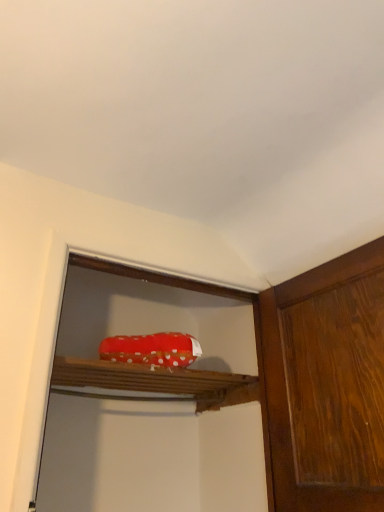
Describe the element at coordinates (152, 383) in the screenshot. The width and height of the screenshot is (384, 512). I see `wooden cabinet at center` at that location.

Find the location of a particular element. wooden cabinet at center is located at coordinates (152, 383).

This screenshot has height=512, width=384. What do you see at coordinates (152, 349) in the screenshot?
I see `red polka dot fabric at center` at bounding box center [152, 349].

Find the location of a particular element. The width and height of the screenshot is (384, 512). red polka dot fabric at center is located at coordinates (152, 349).

Locate an element on the screen. The image size is (384, 512). wooden cabinet at center is located at coordinates (152, 383).

Does red polka dot fabric at center appear on the left side of wooden cabinet at center?

No.

Is red polka dot fabric at center positioned in front of wooden cabinet at center?

No.

Does point (127, 343) come farther from viewer compared to point (109, 369)?

Yes, it is.

From the image's perspective, is red polka dot fabric at center located above or below wooden cabinet at center?

red polka dot fabric at center is situated higher than wooden cabinet at center in the image.

From a real-world perspective, is red polka dot fabric at center above or below wooden cabinet at center?

From a real-world perspective, red polka dot fabric at center is physically above wooden cabinet at center.

Can you confirm if red polka dot fabric at center is wider than wooden cabinet at center?

No, red polka dot fabric at center is not wider than wooden cabinet at center.

Who is shorter, red polka dot fabric at center or wooden cabinet at center?

Standing shorter between the two is red polka dot fabric at center.

Considering the sizes of objects red polka dot fabric at center and wooden cabinet at center in the image provided, who is smaller, red polka dot fabric at center or wooden cabinet at center?

red polka dot fabric at center is smaller.

Is red polka dot fabric at center located outside wooden cabinet at center?

red polka dot fabric at center lies outside wooden cabinet at center's area.

Is red polka dot fabric at center not near wooden cabinet at center?

That's not correct — red polka dot fabric at center is a little close to wooden cabinet at center.

Is red polka dot fabric at center facing away from wooden cabinet at center?

No, wooden cabinet at center is not at the back of red polka dot fabric at center.

At what (x,y) coordinates should I click in order to perform the action: click on stuff located behind the wooden cabinet at center. Please return your answer as a coordinate pair (x, y). The width and height of the screenshot is (384, 512). Looking at the image, I should click on (152, 349).

Considering the positions of objects wooden cabinet at center and red polka dot fabric at center in the image provided, who is more to the right, wooden cabinet at center or red polka dot fabric at center?

red polka dot fabric at center is more to the right.

Is the depth of wooden cabinet at center less than that of red polka dot fabric at center?

Yes.

Is point (106, 380) less distant than point (181, 341)?

No, it is not.

From the image's perspective, which one is positioned higher, wooden cabinet at center or red polka dot fabric at center?

red polka dot fabric at center, from the image's perspective.

From a real-world perspective, is wooden cabinet at center physically below red polka dot fabric at center?

Yes, from a real-world perspective, wooden cabinet at center is below red polka dot fabric at center.

Is wooden cabinet at center thinner than red polka dot fabric at center?

No.

Does wooden cabinet at center have a lesser height compared to red polka dot fabric at center?

No, wooden cabinet at center is not shorter than red polka dot fabric at center.

Who is bigger, wooden cabinet at center or red polka dot fabric at center?

wooden cabinet at center is bigger.

Is wooden cabinet at center outside of red polka dot fabric at center?

Yes, wooden cabinet at center is not within red polka dot fabric at center.

Is wooden cabinet at center next to red polka dot fabric at center and touching it?

No, wooden cabinet at center is not touching red polka dot fabric at center.

Is wooden cabinet at center oriented away from red polka dot fabric at center?

That's not correct — wooden cabinet at center is not looking away from red polka dot fabric at center.

What's the angular difference between wooden cabinet at center and red polka dot fabric at center's facing directions?

The angular difference between wooden cabinet at center and red polka dot fabric at center is 3.7 degrees.

In the image, there is a red polka dot fabric at center. Identify the location of cabinet below it (from a real-world perspective). (152, 383).

You are a GUI agent. You are given a task and a screenshot of the screen. Output one action in this format:
    pyautogui.click(x=<x>, y=<y>)
    Task: Click on the cabinet below the red polka dot fabric at center (from the image's perspective)
    This screenshot has width=384, height=512.
    Given the screenshot: What is the action you would take?
    pyautogui.click(x=152, y=383)

Locate an element on the screen. The height and width of the screenshot is (512, 384). cabinet below the red polka dot fabric at center (from a real-world perspective) is located at coordinates (152, 383).